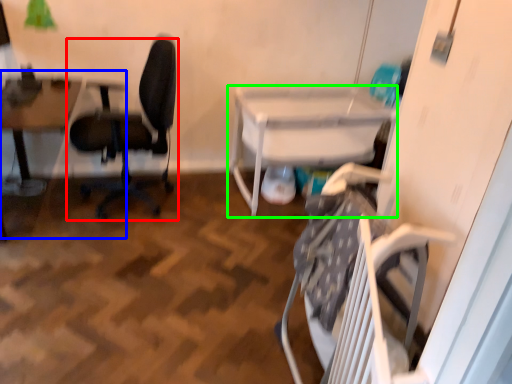
Question: Estimate the real-world distances between objects in this image. Which object is closer to chair (highlighted by a red box), table (highlighted by a blue box) or table (highlighted by a green box)?

Choices:
 (A) table
 (B) table

Answer: (A)